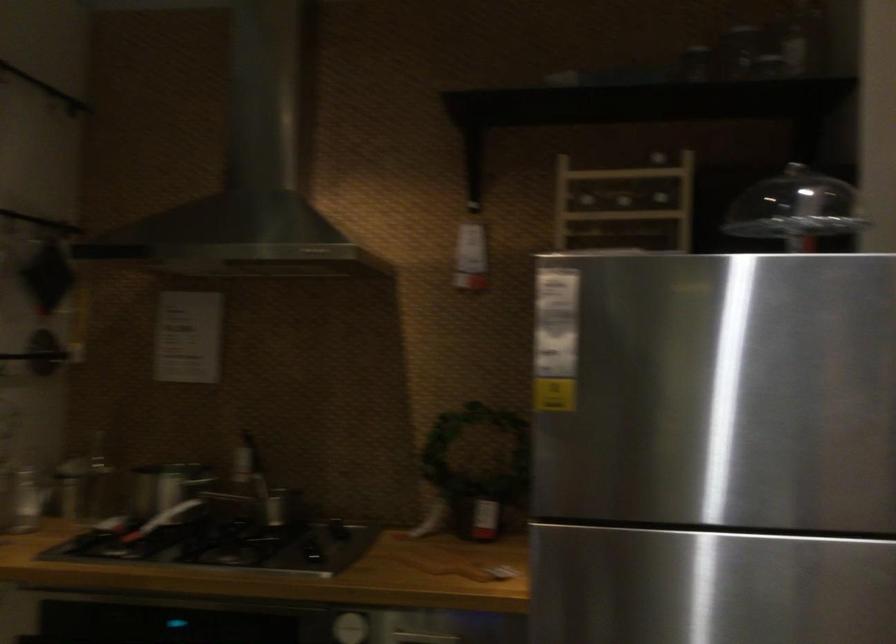
Find where to lift the glass dome handle. Please return your answer as a coordinate pair (x, y).

(780, 187)